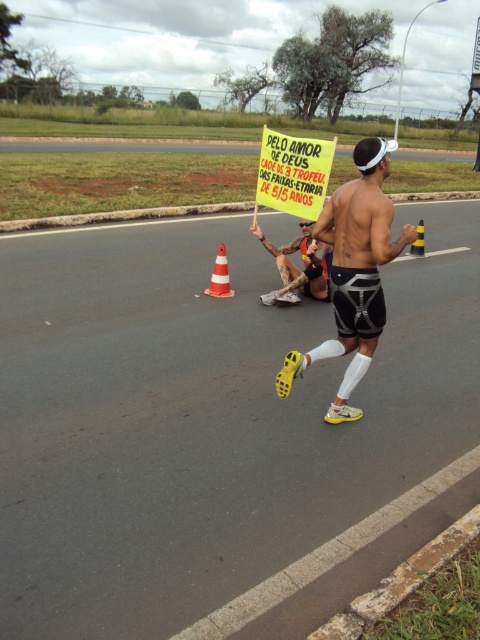
You are a photographer at the running event. You need to take a photo that includes both the yellow paper sign at center and the orange striped traffic cone at center. Which object should be placed closer to the camera to ensure both fit in the frame?

The yellow paper sign at center is wider than the orange striped traffic cone at center, so to fit both in the frame, the yellow paper sign at center should be placed closer to the camera.